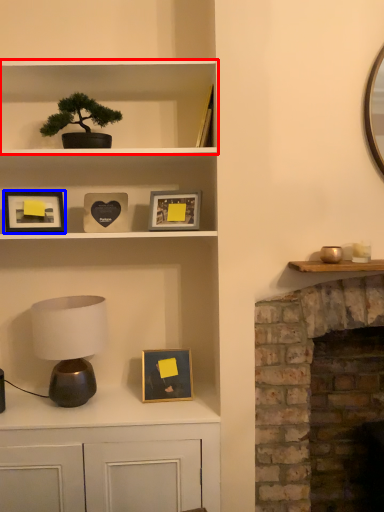
Question: Which of the following is the closest to the observer, shelf (highlighted by a red box) or picture frame (highlighted by a blue box)?

Choices:
 (A) shelf
 (B) picture frame

Answer: (A)